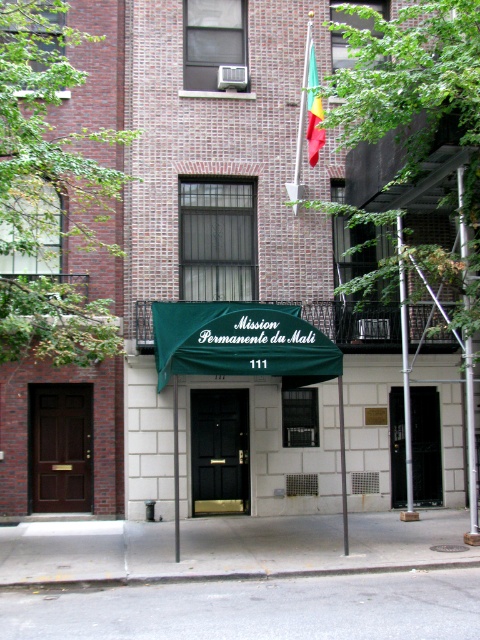
Can you confirm if metallic silver flag pole at upper center is positioned to the left of green fabric pole at center?

In fact, metallic silver flag pole at upper center is to the right of green fabric pole at center.

Who is more distant from viewer, (301, 141) or (172, 420)?

Point (301, 141)

I want to click on metallic silver flag pole at upper center, so (300, 125).

Is brown wooden door at left bigger than metallic silver flag pole at upper center?

Incorrect, brown wooden door at left is not larger than metallic silver flag pole at upper center.

Is point (79, 496) positioned in front of point (304, 92)?

That is True.

Who is more forward, [38,481] or [299,188]?

Positioned in front is point [38,481].

At what (x,y) coordinates should I click in order to perform the action: click on brown wooden door at left. Please return your answer as a coordinate pair (x, y). Image resolution: width=480 pixels, height=640 pixels. Looking at the image, I should click on (60, 448).

Does metal scaffolding at center right have a greater height compared to metallic silver flag pole at upper center?

Incorrect, metal scaffolding at center right's height is not larger of metallic silver flag pole at upper center's.

Is metal scaffolding at center right to the left of metallic silver flag pole at upper center from the viewer's perspective?

In fact, metal scaffolding at center right is to the right of metallic silver flag pole at upper center.

The height and width of the screenshot is (640, 480). In order to click on metal scaffolding at center right in this screenshot , I will do `click(470, 444)`.

You are a GUI agent. You are given a task and a screenshot of the screen. Output one action in this format:
    pyautogui.click(x=<x>, y=<y>)
    Task: Click on the metal scaffolding at center right
    
    Given the screenshot: What is the action you would take?
    pyautogui.click(x=470, y=444)